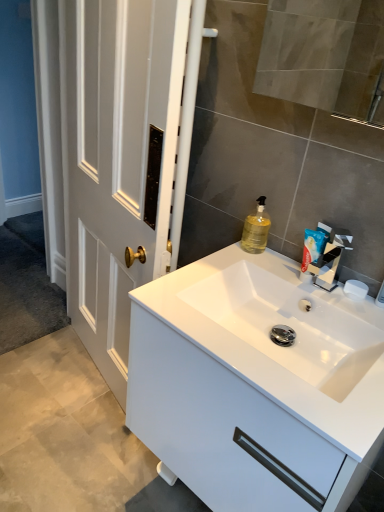
Locate an element on the screen. white matte soap at right is located at coordinates (355, 289).

Locate an element on the screen. This screenshot has height=512, width=384. silver metallic tap at upper right is located at coordinates (330, 257).

Describe the element at coordinates (330, 257) in the screenshot. I see `silver metallic tap at upper right` at that location.

Identify the location of white matte soap at right. This screenshot has width=384, height=512. (355, 289).

Find the location of `cleaning product on the left of white plastic toothpaste tube at upper right`. cleaning product on the left of white plastic toothpaste tube at upper right is located at coordinates (256, 229).

Looking at this image, from the image's perspective, is white plastic toothpaste tube at upper right on top of translucent yellow liquid at sink right?

No, from the image's perspective, white plastic toothpaste tube at upper right is not over translucent yellow liquid at sink right.

Could you tell me if white plastic toothpaste tube at upper right is facing translucent yellow liquid at sink right?

No, white plastic toothpaste tube at upper right is not facing towards translucent yellow liquid at sink right.

From a real-world perspective, is white plastic toothpaste tube at upper right positioned under white matte soap at right based on gravity?

Actually, white plastic toothpaste tube at upper right is physically above white matte soap at right in the real world.

Which of these two, white plastic toothpaste tube at upper right or white matte soap at right, is thinner?

white plastic toothpaste tube at upper right.

Is white plastic toothpaste tube at upper right at the right side of white matte soap at right?

No, white plastic toothpaste tube at upper right is not to the right of white matte soap at right.

Is white plastic toothpaste tube at upper right behind silver metallic tap at upper right?

Yes, the depth of white plastic toothpaste tube at upper right is greater than that of silver metallic tap at upper right.

In order to click on toiletry to the left of silver metallic tap at upper right in this screenshot , I will do `click(314, 245)`.

From a real-world perspective, is white plastic toothpaste tube at upper right physically located above or below silver metallic tap at upper right?

From a real-world perspective, white plastic toothpaste tube at upper right is physically below silver metallic tap at upper right.

Can you tell me how much white plastic toothpaste tube at upper right and silver metallic tap at upper right differ in facing direction?

There is a 1.65-degree angle between the facing directions of white plastic toothpaste tube at upper right and silver metallic tap at upper right.

From a real-world perspective, is white matte soap at right positioned above or below translucent yellow liquid at sink right?

white matte soap at right is situated lower than translucent yellow liquid at sink right in the real world.

Is white matte soap at right wider than translucent yellow liquid at sink right?

In fact, white matte soap at right might be narrower than translucent yellow liquid at sink right.

Based on the photo, considering the positions of objects white matte soap at right and translucent yellow liquid at sink right in the image provided, who is behind, white matte soap at right or translucent yellow liquid at sink right?

translucent yellow liquid at sink right is further away from the camera.

Between point (277, 273) and point (315, 245), which one is positioned in front?

The point (315, 245) is in front.

Is white glossy cabinet at center turned away from white plastic toothpaste tube at upper right?

No, white glossy cabinet at center's orientation is not away from white plastic toothpaste tube at upper right.

Considering the positions of objects white glossy cabinet at center and white plastic toothpaste tube at upper right in the image provided, who is in front, white glossy cabinet at center or white plastic toothpaste tube at upper right?

white glossy cabinet at center.

How much distance is there between white glossy cabinet at center and white plastic toothpaste tube at upper right?

white glossy cabinet at center is 15.41 inches from white plastic toothpaste tube at upper right.

Between white matte soap at right and silver metallic tap at upper right, which one has less height?

white matte soap at right is shorter.

What are the coordinates of `soap on the right of silver metallic tap at upper right` in the screenshot? It's located at (355, 289).

In the scene shown: Is white matte soap at right facing away from silver metallic tap at upper right?

That's not correct — white matte soap at right is not looking away from silver metallic tap at upper right.

Is the depth of white matte soap at right greater than that of silver metallic tap at upper right?

That is True.

Is translucent yellow liquid at sink right not inside white matte soap at right?

Indeed, translucent yellow liquid at sink right is completely outside white matte soap at right.

Looking at this image, how many degrees apart are the facing directions of translucent yellow liquid at sink right and white matte soap at right?

The facing directions of translucent yellow liquid at sink right and white matte soap at right are 2.02 degrees apart.

How far apart are translucent yellow liquid at sink right and white matte soap at right?

translucent yellow liquid at sink right is 12.29 inches away from white matte soap at right.

I want to click on cleaning product that is on the left side of white matte soap at right, so click(256, 229).

There is a white plastic toothpaste tube at upper right. Where is `cleaning product above it (from a real-world perspective)`? cleaning product above it (from a real-world perspective) is located at coordinates (256, 229).

At what (x,y) coordinates should I click in order to perform the action: click on toiletry lying above the white matte soap at right (from the image's perspective). Please return your answer as a coordinate pair (x, y). The width and height of the screenshot is (384, 512). Looking at the image, I should click on (314, 245).

When comparing their distances from white plastic toothpaste tube at upper right, does white matte soap at right or translucent yellow liquid at sink right seem further?

translucent yellow liquid at sink right.

Considering their positions, is white matte soap at right positioned closer to silver metallic tap at upper right than white glossy cabinet at center?

The object closer to silver metallic tap at upper right is white matte soap at right.

Looking at the image, which one is located further to white matte soap at right, white glossy cabinet at center or white plastic toothpaste tube at upper right?

Based on the image, white glossy cabinet at center appears to be further to white matte soap at right.

Which object lies further to the anchor point silver metallic tap at upper right, white glossy cabinet at center or translucent yellow liquid at sink right?

Based on the image, white glossy cabinet at center appears to be further to silver metallic tap at upper right.

Based on their spatial positions, is silver metallic tap at upper right or white matte soap at right further from white glossy cabinet at center?

white matte soap at right is positioned further to the anchor white glossy cabinet at center.

From the picture: When comparing their distances from white glossy cabinet at center, does translucent yellow liquid at sink right or silver metallic tap at upper right seem closer?

Based on the image, silver metallic tap at upper right appears to be nearer to white glossy cabinet at center.

From the image, which object appears to be farther from translucent yellow liquid at sink right, white matte soap at right or silver metallic tap at upper right?

white matte soap at right lies further to translucent yellow liquid at sink right than the other object.

Based on their spatial positions, is white plastic toothpaste tube at upper right or silver metallic tap at upper right further from translucent yellow liquid at sink right?

silver metallic tap at upper right lies further to translucent yellow liquid at sink right than the other object.

You are a GUI agent. You are given a task and a screenshot of the screen. Output one action in this format:
    pyautogui.click(x=<x>, y=<y>)
    Task: Click on the tap between white plastic toothpaste tube at upper right and white glossy cabinet at center from top to bottom
    Image resolution: width=384 pixels, height=512 pixels.
    Given the screenshot: What is the action you would take?
    pyautogui.click(x=330, y=257)

Locate an element on the screen. The image size is (384, 512). tap situated between white plastic toothpaste tube at upper right and white matte soap at right from left to right is located at coordinates (330, 257).

The image size is (384, 512). In order to click on soap between translucent yellow liquid at sink right and white glossy cabinet at center from top to bottom in this screenshot , I will do `click(355, 289)`.

This screenshot has height=512, width=384. I want to click on tap between translucent yellow liquid at sink right and white glossy cabinet at center in the vertical direction, so click(330, 257).